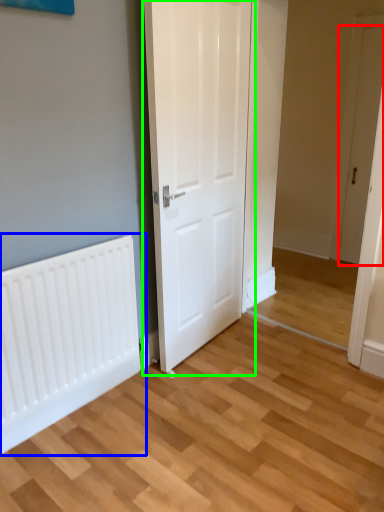
Question: Which object is positioned closest to door (highlighted by a red box)? Select from radiator (highlighted by a blue box) and door (highlighted by a green box).

Choices:
 (A) radiator
 (B) door

Answer: (B)